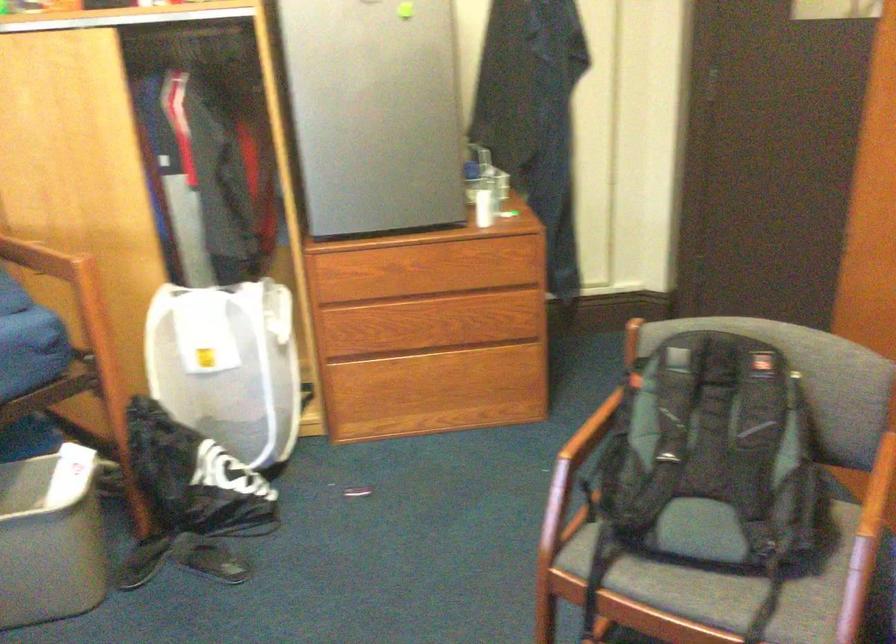
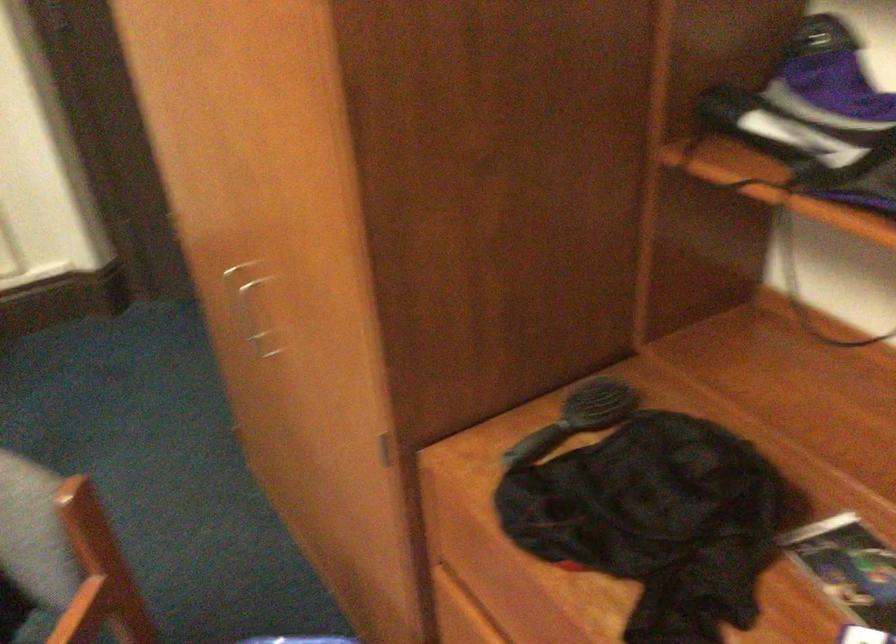
Which direction would the cameraman need to move to produce the second image?

The movement direction of the cameraman is right, forward.